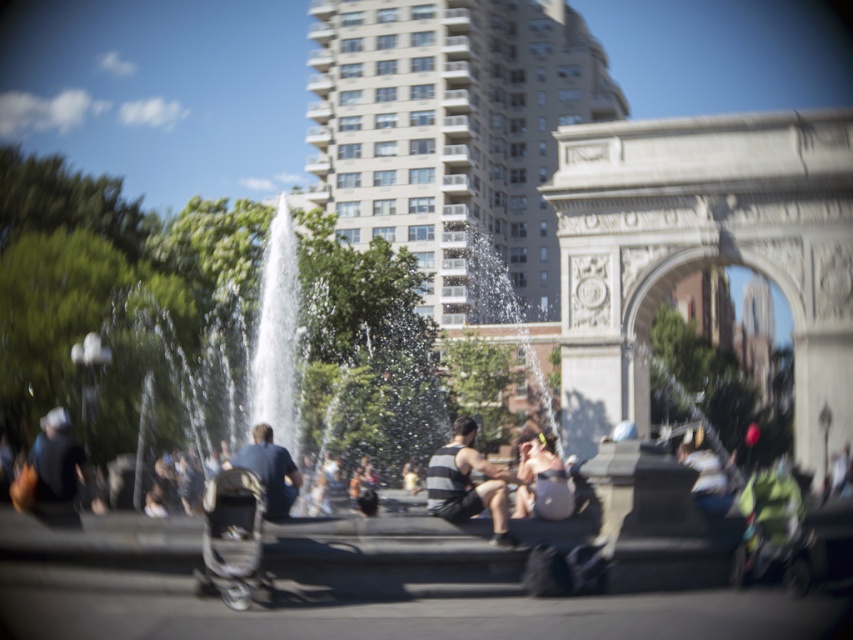
Question: Which object is the farthest from the dark gray fabric jacket at lower left?

Choices:
 (A) matte black shorts at center
 (B) dark blue shirt at center

Answer: (A)

Question: Based on their relative distances, which object is farther from the matte black shorts at center?

Choices:
 (A) dark gray fabric jacket at lower left
 (B) silver metallic baby carriage at lower left
 (C) striped fabric tank top at center

Answer: (A)

Question: Which of these objects is positioned closest to the dark gray fabric jacket at lower left?

Choices:
 (A) striped fabric tank top at center
 (B) silver metallic baby carriage at lower left

Answer: (B)

Question: Can you confirm if silver metallic baby carriage at lower left is positioned above dark blue shirt at center?

Choices:
 (A) yes
 (B) no

Answer: (B)

Question: Is dark gray fabric jacket at lower left behind dark blue shirt at center?

Choices:
 (A) no
 (B) yes

Answer: (B)

Question: Does matte black shorts at center lie in front of dark blue shirt at center?

Choices:
 (A) no
 (B) yes

Answer: (A)